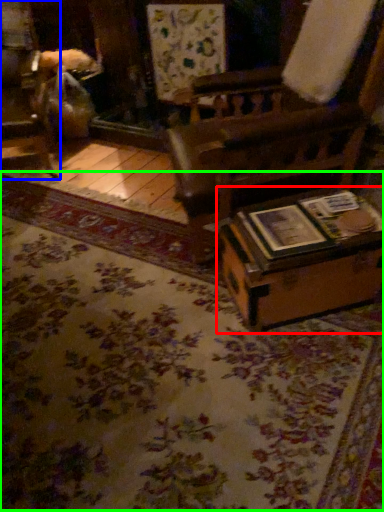
Question: Which is farther away from table (highlighted by a red box)? furniture (highlighted by a blue box) or mat (highlighted by a green box)?

Choices:
 (A) furniture
 (B) mat

Answer: (A)